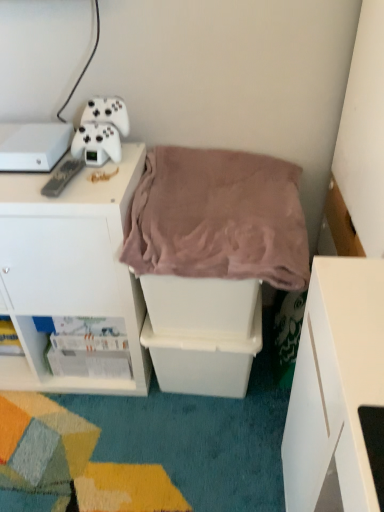
Question: Does black plastic remote at upper left have a lesser height compared to white plastic cabinet at upper left?

Choices:
 (A) no
 (B) yes

Answer: (B)

Question: Could white plastic cabinet at upper left be considered to be inside black plastic remote at upper left?

Choices:
 (A) no
 (B) yes

Answer: (A)

Question: Is black plastic remote at upper left smaller than white plastic cabinet at upper left?

Choices:
 (A) no
 (B) yes

Answer: (B)

Question: Considering the relative sizes of black plastic remote at upper left and white plastic cabinet at upper left in the image provided, is black plastic remote at upper left wider than white plastic cabinet at upper left?

Choices:
 (A) no
 (B) yes

Answer: (A)

Question: Can you confirm if black plastic remote at upper left is bigger than white plastic cabinet at upper left?

Choices:
 (A) no
 (B) yes

Answer: (A)

Question: From a real-world perspective, is white matte game controller at upper left physically located above or below white glossy magazine at lower left, the first shelf positioned from the left?

Choices:
 (A) above
 (B) below

Answer: (A)

Question: From the image's perspective, is white matte game controller at upper left located above or below white glossy magazine at lower left, the first shelf positioned from the left?

Choices:
 (A) above
 (B) below

Answer: (A)

Question: Is point (110, 130) closer or farther from the camera than point (72, 349)?

Choices:
 (A) farther
 (B) closer

Answer: (B)

Question: Based on their sizes in the image, would you say white matte game controller at upper left is bigger or smaller than white glossy magazine at lower left, which ranks as the second shelf in right-to-left order?

Choices:
 (A) big
 (B) small

Answer: (B)

Question: From the image's perspective, is white matte game controller at upper left positioned above or below mauve plush blanket at center?

Choices:
 (A) above
 (B) below

Answer: (A)

Question: Is white matte game controller at upper left in front of or behind mauve plush blanket at center in the image?

Choices:
 (A) front
 (B) behind

Answer: (B)

Question: From a real-world perspective, is white matte game controller at upper left positioned above or below mauve plush blanket at center?

Choices:
 (A) above
 (B) below

Answer: (A)

Question: In terms of size, does white matte game controller at upper left appear bigger or smaller than mauve plush blanket at center?

Choices:
 (A) big
 (B) small

Answer: (B)

Question: Visually, is white plastic storage bin at center, the first shelf in the right-to-left sequence, positioned to the left or to the right of white glossy magazine at lower left, the first shelf positioned from the left?

Choices:
 (A) left
 (B) right

Answer: (B)

Question: Looking at the image, does white plastic storage bin at center, placed as the second shelf when sorted from left to right, seem bigger or smaller compared to white glossy magazine at lower left, the first shelf positioned from the left?

Choices:
 (A) small
 (B) big

Answer: (B)